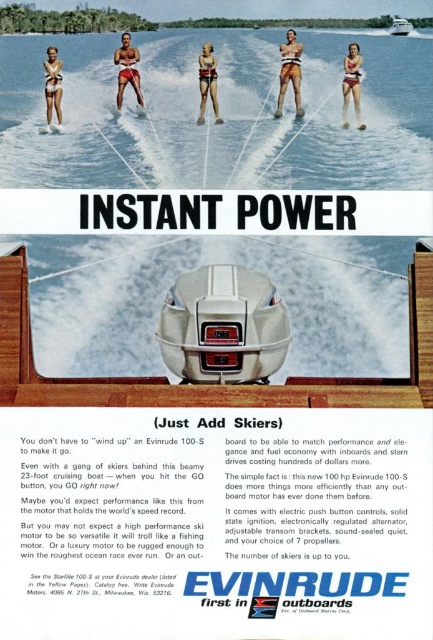
In the vintage Evinrude advertisement, you see the matte black skis at center and the matte white bikini at upper left. Which object is positioned higher up in the image?

The matte white bikini at upper left is positioned higher up in the image than the matte black skis at center.

You are designing a poster and need to know the relative sizes of the objects in the image. Based on the scene, which object is wider between the matte black skis at center and the matte white bikini at upper left?

The matte black skis at center might be wider than matte white bikini at upper left according to the description.

You are a photographer trying to capture the Evinrude 100 S motor advertisement. You notice the matte black motorboat at center and the matte red shorts at center. Based on their positions in the image, which object is closer to the bottom of the frame?

The matte black motorboat at center is below the matte red shorts at center, so it is closer to the bottom of the frame.